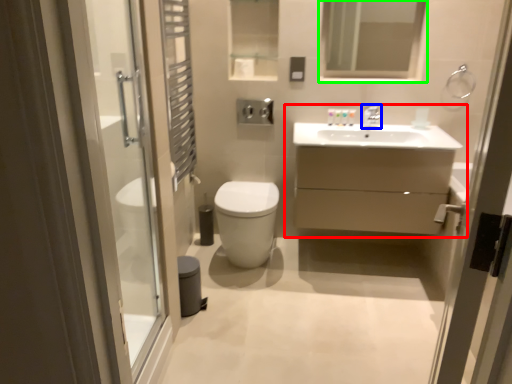
Question: Considering the real-world distances, which object is farthest from bathroom cabinet (highlighted by a red box)? tap (highlighted by a blue box) or mirror (highlighted by a green box)?

Choices:
 (A) tap
 (B) mirror

Answer: (B)